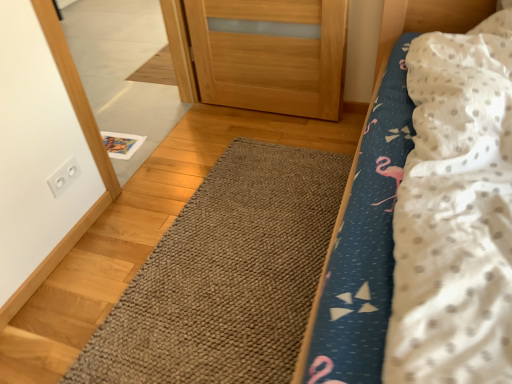
Locate an element on the screen. Image resolution: width=512 pixels, height=384 pixels. vacant space underneath brown textured rug at center (from a real-world perspective) is located at coordinates (241, 249).